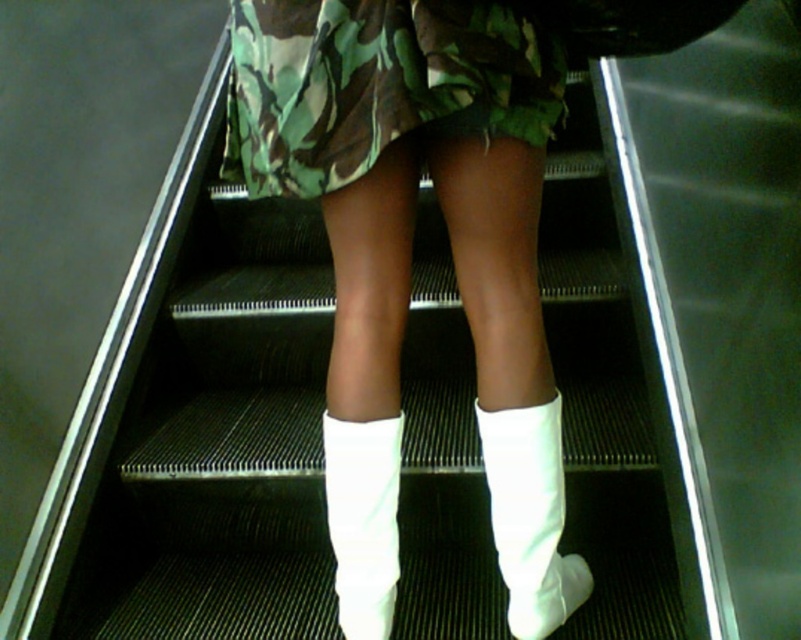
You are designing a safety system for escalators and need to ensure that the camo fabric skirt at center does not interfere with the steps. Based on its position, can you determine if the skirt is positioned over the moving parts of the escalator?

The camo fabric skirt at center is located at point (377, 84), which is typically where the skirt board is placed on an escalator to protect against gaps between steps. This position is standard and does not interfere with the moving steps themselves.